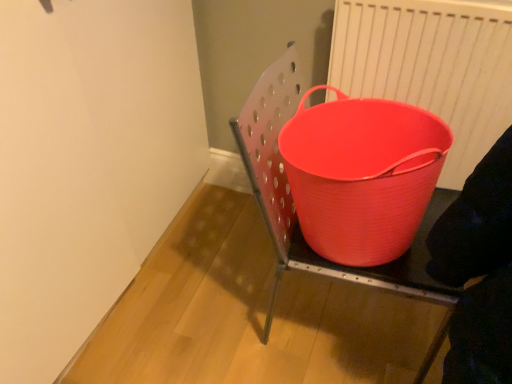
Question: In terms of height, does matte plastic bucket at center look taller or shorter compared to white plastic radiator at upper right?

Choices:
 (A) tall
 (B) short

Answer: (B)

Question: Considering their positions, is matte plastic bucket at center located in front of or behind white plastic radiator at upper right?

Choices:
 (A) front
 (B) behind

Answer: (A)

Question: Which object is positioned farthest from the matte plastic bucket at right?

Choices:
 (A) matte plastic bucket at center
 (B) matte plastic bucket at center
 (C) white plastic radiator at upper right

Answer: (C)

Question: Which object is the farthest from the white plastic radiator at upper right?

Choices:
 (A) matte plastic bucket at right
 (B) matte plastic bucket at center
 (C) matte plastic bucket at center

Answer: (A)